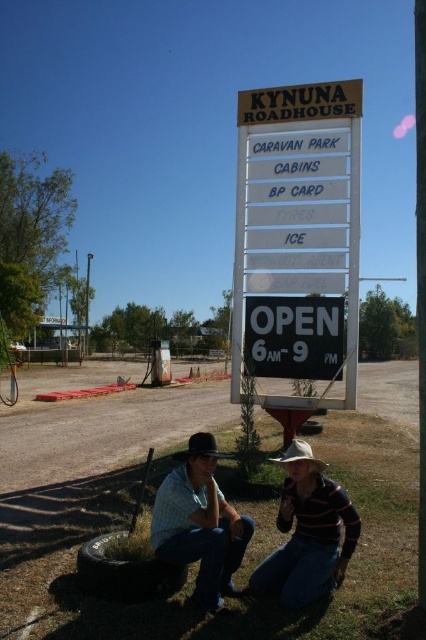
You are a delivery driver who needs to park your truck near the brown wooden sign at center without blocking the path to the denim jeans at lower center. The truck requires 4 meters of space to park safely. Can you park your truck between them?

The distance between the brown wooden sign at center and denim jeans at lower center is 3.94 meters. Since the truck needs 4 meters to park safely, there isn not enough space between them for the truck to park without blocking the path.

You are a photographer trying to capture a person sitting on the ground at Kynuna Roadhouse. According to the image, where should you position your camera relative to the striped cotton shirt at lower center and denim jeans at lower center to ensure both are visible in the frame?

Since the striped cotton shirt at lower center is positioned under denim jeans at lower center, you should position your camera at a lower angle to capture both the striped cotton shirt at lower center and denim jeans at lower center in the frame.